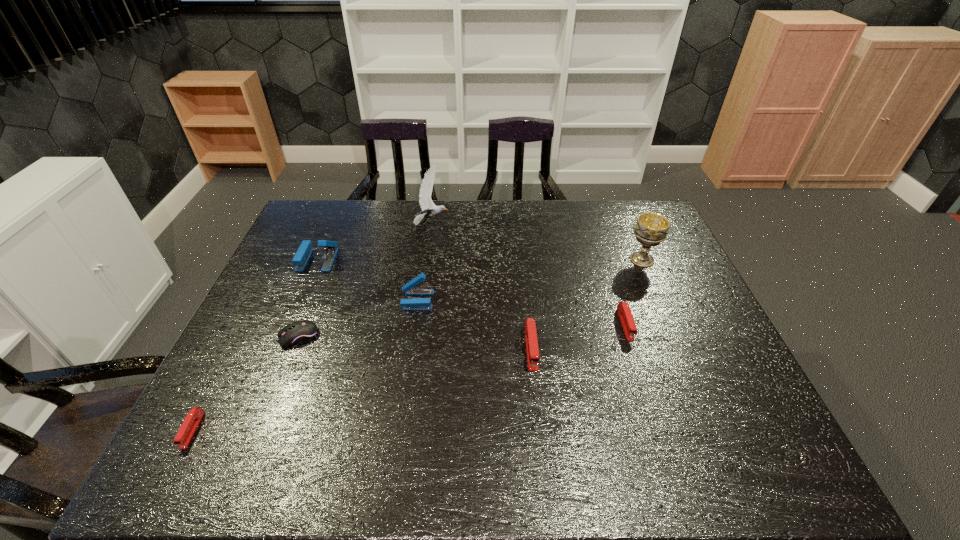
Where is `free space between the shortest stapler and the fourth shortest object`? free space between the shortest stapler and the fourth shortest object is located at coordinates (362, 389).

I want to click on free space that is in between the farther blue stapler and the white chalice, so click(x=480, y=260).

You are a GUI agent. You are given a task and a screenshot of the screen. Output one action in this format:
    pyautogui.click(x=<x>, y=<y>)
    Task: Click on the sixth closest object to the chalice
    The width and height of the screenshot is (960, 540).
    Given the screenshot: What is the action you would take?
    pyautogui.click(x=303, y=253)

Where is `object that is the seventh closest to the second object from right to left`? This screenshot has width=960, height=540. object that is the seventh closest to the second object from right to left is located at coordinates (193, 418).

The height and width of the screenshot is (540, 960). In order to click on stapler object that ranks as the fourth closest to the second object from right to left in this screenshot , I will do `click(193, 418)`.

Point out which stapler is positioned as the nearest to the computer mouse. Please provide its 2D coordinates. Your answer should be formatted as a tuple, i.e. [(x, y)], where the tuple contains the x and y coordinates of a point satisfying the conditions above.

[(193, 418)]

Select which red stapler appears as the closest to the gull. Please provide its 2D coordinates. Your answer should be formatted as a tuple, i.e. [(x, y)], where the tuple contains the x and y coordinates of a point satisfying the conditions above.

[(533, 359)]

The width and height of the screenshot is (960, 540). In order to click on red stapler that can be found as the closest to the fourth tallest stapler in this screenshot , I will do pos(533,359).